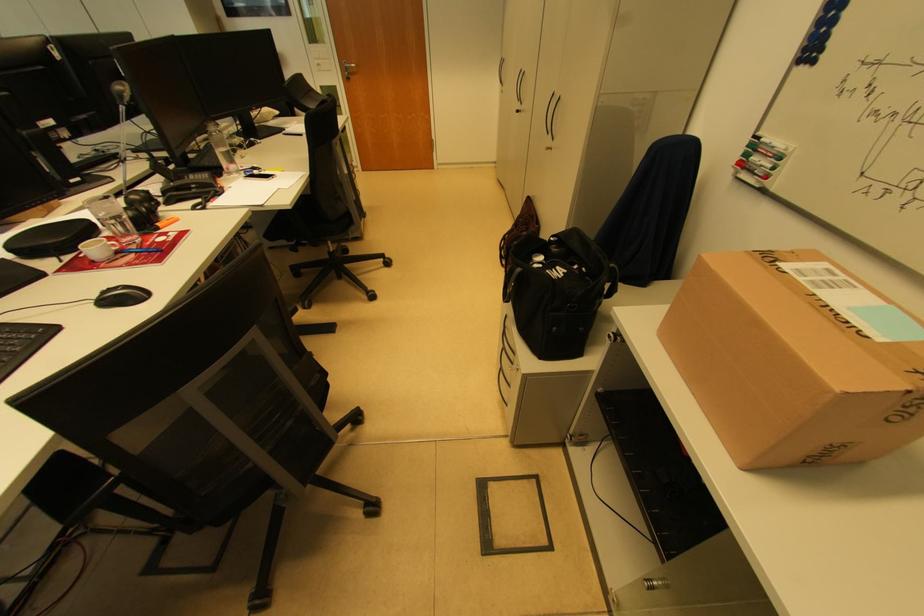
Identify the location of black whiteboard marker. [x=771, y=140].